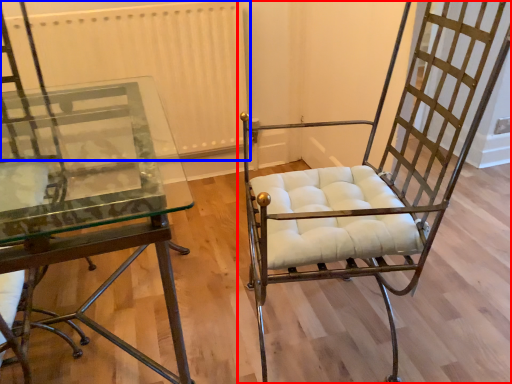
Question: Which object appears closest to the camera in this image, chair (highlighted by a red box) or radiator (highlighted by a blue box)?

Choices:
 (A) chair
 (B) radiator

Answer: (A)